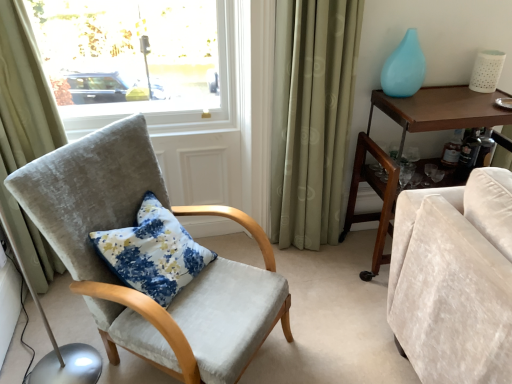
What is the approximate width of beige fabric curtain at left, arranged as the 2th curtain when viewed from the right?

It is 9.06 inches.

What do you see at coordinates (377, 193) in the screenshot?
I see `brown wood desk at right` at bounding box center [377, 193].

Where is `green fabric curtain at center, arranged as the first curtain when viewed from the right`? The width and height of the screenshot is (512, 384). green fabric curtain at center, arranged as the first curtain when viewed from the right is located at coordinates (311, 117).

Where is `glass vase behind the green fabric curtain at center, which is counted as the second curtain, starting from the left`? This screenshot has width=512, height=384. glass vase behind the green fabric curtain at center, which is counted as the second curtain, starting from the left is located at coordinates (404, 68).

Between light blue glass vase at upper right and green fabric curtain at center, which is counted as the second curtain, starting from the left, which one is positioned behind?

light blue glass vase at upper right is behind.

Which object is wider, light blue glass vase at upper right or green fabric curtain at center, which is counted as the second curtain, starting from the left?

Wider between the two is green fabric curtain at center, which is counted as the second curtain, starting from the left.

Based on the photo, measure the distance between light blue glass vase at upper right and velvet cushioned chair at left.

light blue glass vase at upper right is 3.97 feet from velvet cushioned chair at left.

Considering their positions, is light blue glass vase at upper right located in front of or behind velvet cushioned chair at left?

light blue glass vase at upper right is positioned farther from the viewer than velvet cushioned chair at left.

Which is behind, point (410, 35) or point (165, 205)?

Point (410, 35)

From a real-world perspective, is velvet cushioned chair at left under green fabric curtain at center, arranged as the first curtain when viewed from the right?

Yes, from a real-world perspective, velvet cushioned chair at left is under green fabric curtain at center, arranged as the first curtain when viewed from the right.

Is velvet cushioned chair at left facing away from green fabric curtain at center, which is counted as the second curtain, starting from the left?

No, velvet cushioned chair at left is not facing the opposite direction of green fabric curtain at center, which is counted as the second curtain, starting from the left.

Is velvet cushioned chair at left taller than green fabric curtain at center, arranged as the first curtain when viewed from the right?

In fact, velvet cushioned chair at left may be shorter than green fabric curtain at center, arranged as the first curtain when viewed from the right.

Is the position of velvet cushioned chair at left more distant than that of green fabric curtain at center, which is counted as the second curtain, starting from the left?

No, it is in front of green fabric curtain at center, which is counted as the second curtain, starting from the left.

Is light blue glass vase at upper right at the back of floral fabric cushion at center?

No, floral fabric cushion at center's orientation is not away from light blue glass vase at upper right.

Considering the sizes of objects floral fabric cushion at center and light blue glass vase at upper right in the image provided, who is bigger, floral fabric cushion at center or light blue glass vase at upper right?

floral fabric cushion at center is bigger.

From a real-world perspective, between floral fabric cushion at center and light blue glass vase at upper right, who is vertically lower?

floral fabric cushion at center is physically lower.

Considering the positions of objects floral fabric cushion at center and velvet cushioned chair at left in the image provided, who is behind, floral fabric cushion at center or velvet cushioned chair at left?

floral fabric cushion at center is more distant.

In the image, there is a velvet cushioned chair at left. At what (x,y) coordinates should I click in order to perform the action: click on pillow below it (from a real-world perspective). Please return your answer as a coordinate pair (x, y). The width and height of the screenshot is (512, 384). Looking at the image, I should click on (153, 252).

Is point (142, 219) behind point (157, 186)?

No, it is not.

Can you confirm if floral fabric cushion at center is wider than velvet cushioned chair at left?

In fact, floral fabric cushion at center might be narrower than velvet cushioned chair at left.

In terms of height, does velvet cushioned chair at left look taller or shorter compared to floral fabric cushion at center?

velvet cushioned chair at left is taller than floral fabric cushion at center.

Considering the relative sizes of velvet cushioned chair at left and floral fabric cushion at center in the image provided, is velvet cushioned chair at left bigger than floral fabric cushion at center?

Correct, velvet cushioned chair at left is larger in size than floral fabric cushion at center.

Considering their positions, is velvet cushioned chair at left located in front of or behind floral fabric cushion at center?

Visually, velvet cushioned chair at left is located in front of floral fabric cushion at center.

From a real-world perspective, is green fabric curtain at center, arranged as the first curtain when viewed from the right, beneath brown wood desk at right?

Actually, green fabric curtain at center, arranged as the first curtain when viewed from the right, is physically above brown wood desk at right in the real world.

Locate an element on the screen. desk below the green fabric curtain at center, which is counted as the second curtain, starting from the left (from the image's perspective) is located at coordinates (377, 193).

Is green fabric curtain at center, which is counted as the second curtain, starting from the left, at the right side of brown wood desk at right?

No.

In terms of size, does green fabric curtain at center, arranged as the first curtain when viewed from the right, appear bigger or smaller than brown wood desk at right?

green fabric curtain at center, arranged as the first curtain when viewed from the right, is smaller than brown wood desk at right.

Identify the location of glass vase that is above the green fabric curtain at center, which is counted as the second curtain, starting from the left (from the image's perspective). This screenshot has width=512, height=384. (404, 68).

This screenshot has height=384, width=512. I want to click on glass vase above the velvet cushioned chair at left (from a real-world perspective), so click(x=404, y=68).

Based on their spatial positions, is floral fabric cushion at center or brown wood desk at right closer to light blue glass vase at upper right?

brown wood desk at right.

Estimate the real-world distances between objects in this image. Which object is further from light blue glass vase at upper right, floral fabric cushion at center or beige fabric curtain at left, which is the first curtain from left to right?

beige fabric curtain at left, which is the first curtain from left to right.

Based on their spatial positions, is green fabric curtain at center, arranged as the first curtain when viewed from the right, or beige fabric curtain at left, arranged as the 2th curtain when viewed from the right, closer to brown wood desk at right?

green fabric curtain at center, arranged as the first curtain when viewed from the right, is positioned closer to the anchor brown wood desk at right.

Looking at the image, which one is located further to beige fabric curtain at left, which is the first curtain from left to right, brown wood desk at right or light blue glass vase at upper right?

Based on the image, light blue glass vase at upper right appears to be further to beige fabric curtain at left, which is the first curtain from left to right.

Based on their spatial positions, is green fabric curtain at center, which is counted as the second curtain, starting from the left, or brown wood desk at right closer to velvet cushioned chair at left?

The object closer to velvet cushioned chair at left is green fabric curtain at center, which is counted as the second curtain, starting from the left.

Which object lies further to the anchor point brown wood desk at right, green fabric curtain at center, which is counted as the second curtain, starting from the left, or light blue glass vase at upper right?

Based on the image, light blue glass vase at upper right appears to be further to brown wood desk at right.

Looking at this image, based on their spatial positions, is green fabric curtain at center, which is counted as the second curtain, starting from the left, or velvet cushioned chair at left closer to light blue glass vase at upper right?

green fabric curtain at center, which is counted as the second curtain, starting from the left, lies closer to light blue glass vase at upper right than the other object.

From the image, which object appears to be nearer to floral fabric cushion at center, velvet cushioned chair at left or brown wood desk at right?

The object closer to floral fabric cushion at center is velvet cushioned chair at left.

Where is `curtain between velvet cushioned chair at left and brown wood desk at right from left to right`? The height and width of the screenshot is (384, 512). curtain between velvet cushioned chair at left and brown wood desk at right from left to right is located at coordinates (311, 117).

This screenshot has height=384, width=512. I want to click on chair located between floral fabric cushion at center and light blue glass vase at upper right in the left-right direction, so [117, 277].

Find the location of a particular element. This screenshot has width=512, height=384. curtain situated between floral fabric cushion at center and brown wood desk at right from left to right is located at coordinates (311, 117).

Identify the location of pillow between beige fabric curtain at left, arranged as the 2th curtain when viewed from the right, and light blue glass vase at upper right, in the horizontal direction. The width and height of the screenshot is (512, 384). (153, 252).